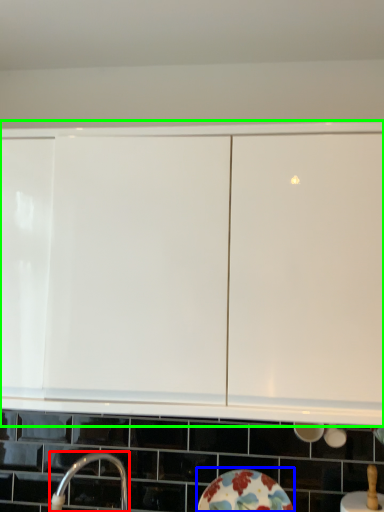
Question: Which object is positioned closest to tap (highlighted by a red box)? Select from plate (highlighted by a blue box) and cabinetry (highlighted by a green box).

Choices:
 (A) plate
 (B) cabinetry

Answer: (A)